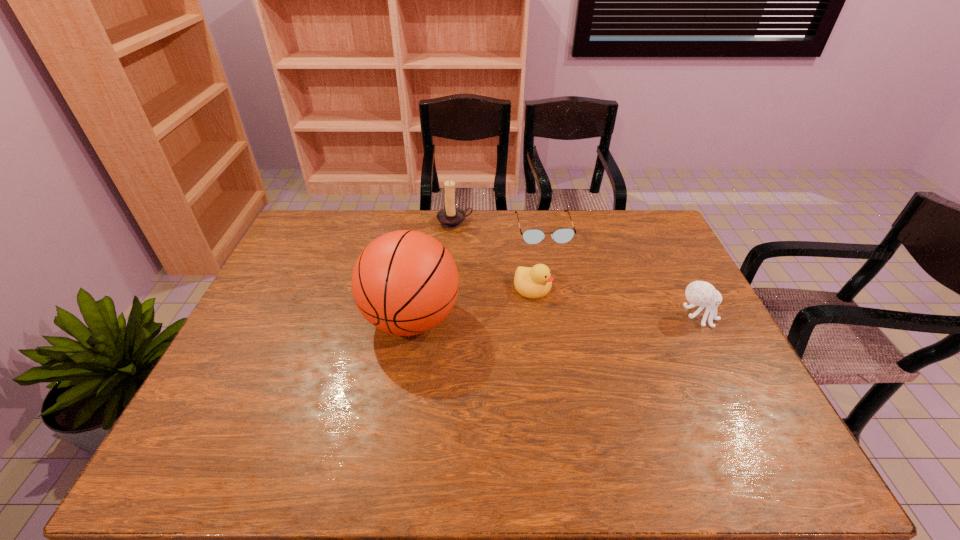
In order to click on free location located on the lenses of the spectacles in this screenshot , I will do `click(556, 275)`.

The height and width of the screenshot is (540, 960). What are the coordinates of `vacant space located on the lenses of the spectacles` in the screenshot? It's located at (555, 271).

In order to click on free spot located 0.360m on the lenses of the spectacles in this screenshot , I will do `click(568, 320)`.

Find the location of a particular element. vacant space positioned 0.280m on the wick of the fourth shortest object is located at coordinates (493, 277).

Where is `free space located 0.250m on the wick of the fourth shortest object`? The image size is (960, 540). free space located 0.250m on the wick of the fourth shortest object is located at coordinates (490, 272).

Where is `free space located 0.370m on the wick of the fourth shortest object`? Image resolution: width=960 pixels, height=540 pixels. free space located 0.370m on the wick of the fourth shortest object is located at coordinates (505, 295).

This screenshot has height=540, width=960. I want to click on spectacles that is positioned at the far edge, so click(x=531, y=236).

You are a GUI agent. You are given a task and a screenshot of the screen. Output one action in this format:
    pyautogui.click(x=<x>, y=<y>)
    Task: Click on the candle holder located in the far edge section of the desktop
    Image resolution: width=960 pixels, height=540 pixels.
    Given the screenshot: What is the action you would take?
    pyautogui.click(x=450, y=217)

Locate an element on the screen. The height and width of the screenshot is (540, 960). object situated at the right edge is located at coordinates (698, 293).

In the image, there is a desktop. Identify the location of vacant space at the far edge. This screenshot has height=540, width=960. (373, 239).